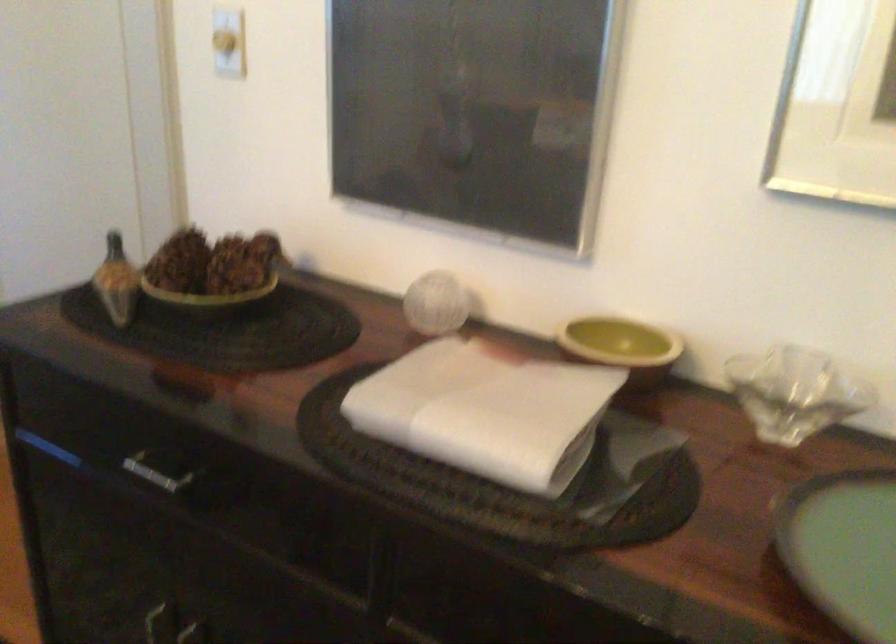
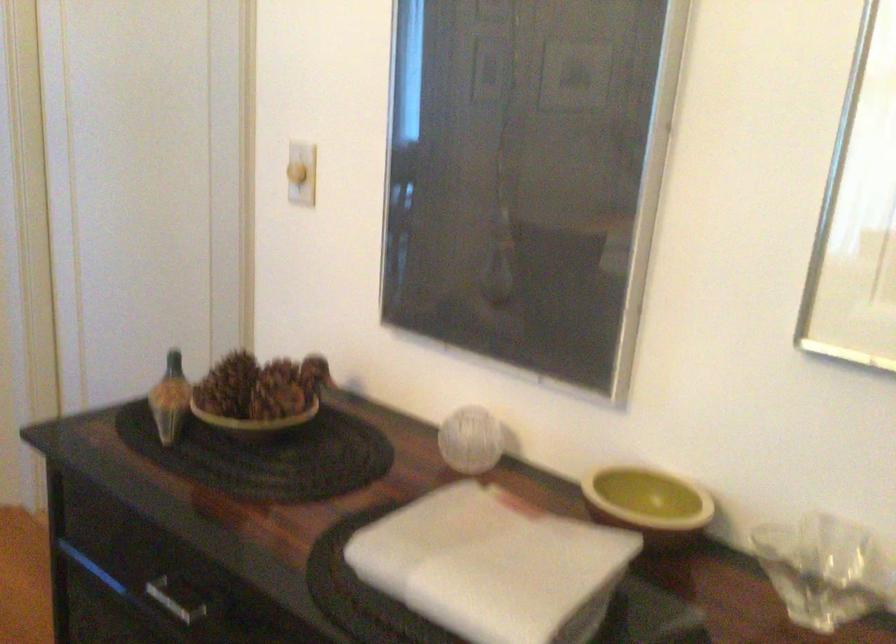
Locate, in the second image, the point that corresponds to point (158, 477) in the first image.

(177, 598)